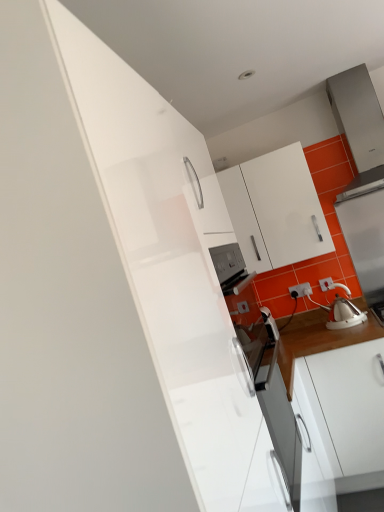
Question: Is point tap(271, 161) closer or farther from the camera than point tap(360, 193)?

Choices:
 (A) closer
 (B) farther

Answer: (A)

Question: In the image, is white glossy cabinet at upper center positioned in front of or behind white glossy kettle at right?

Choices:
 (A) front
 (B) behind

Answer: (A)

Question: Which object is positioned farthest from the white glossy tea pot at right?

Choices:
 (A) white glossy kettle at right
 (B) white glossy cabinet at upper center
 (C) white plastic electric outlet at lower right

Answer: (B)

Question: Considering the real-world distances, which object is closest to the white glossy kettle at right?

Choices:
 (A) white glossy cabinet at upper center
 (B) white plastic electric outlet at lower right
 (C) white glossy tea pot at right

Answer: (C)